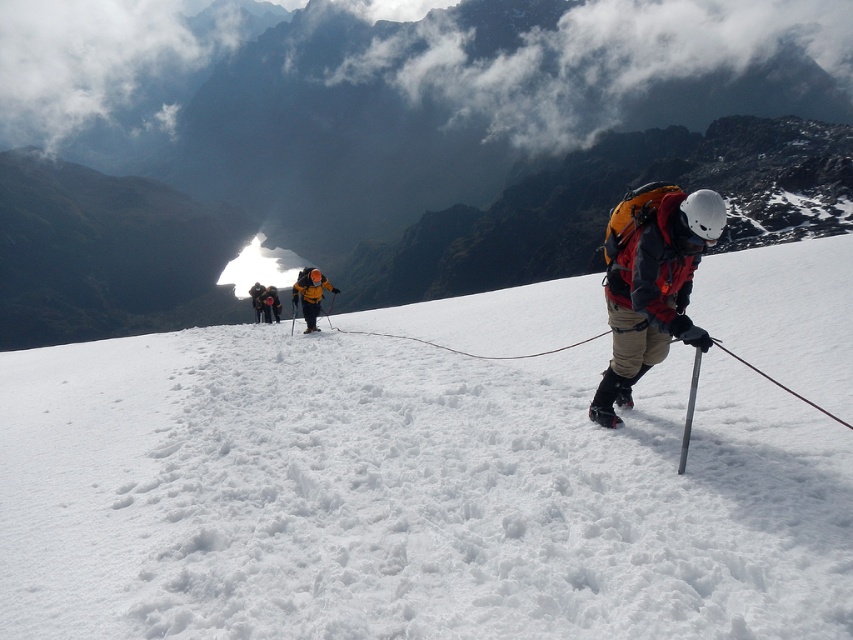
You are a member of the climbing team and need to determine the order of climbers based on their jacket colors. Which climber is positioned lower on the slope, the one wearing the orange fabric jacket at center or the one wearing the yellow fabric jacket at center?

The orange fabric jacket at center is located below the yellow fabric jacket at center, so the climber in the orange fabric jacket at center is positioned lower on the slope.

You are a hiker planning to cross a narrow snow bridge. You have the orange fabric jacket at center and the yellow matte ski at center. Which item should you use to test the snow bridge first to ensure safety?

The orange fabric jacket at center might be wider than yellow matte ski at center, so it would distribute your weight more evenly and is safer to test the snow bridge first.